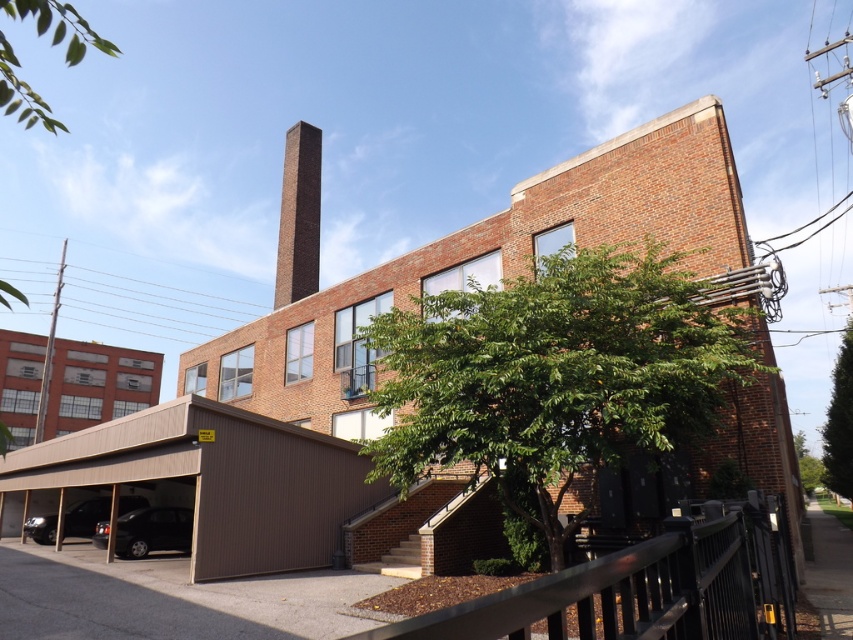
Who is positioned more to the left, black metal fence at lower right or green leafy tree at right?

Positioned to the left is black metal fence at lower right.

Which is behind, point (769, 529) or point (851, 376)?

The point (851, 376) is more distant.

Is point (683, 541) closer to viewer compared to point (845, 403)?

Yes, point (683, 541) is in front of point (845, 403).

The image size is (853, 640). Identify the location of black metal fence at lower right. (645, 588).

Looking at this image, who is more forward, (454, 355) or (299, 180)?

Positioned in front is point (454, 355).

Image resolution: width=853 pixels, height=640 pixels. Describe the element at coordinates (556, 374) in the screenshot. I see `green leafy tree at center` at that location.

Find the location of a particular element. The width and height of the screenshot is (853, 640). green leafy tree at center is located at coordinates (556, 374).

Does black metal fence at lower right appear on the left side of brick chimney at upper center?

In fact, black metal fence at lower right is to the right of brick chimney at upper center.

In the scene shown: Who is more forward, (764, 589) or (292, 211)?

Positioned in front is point (764, 589).

Where is `black metal fence at lower right`? The height and width of the screenshot is (640, 853). black metal fence at lower right is located at coordinates (645, 588).